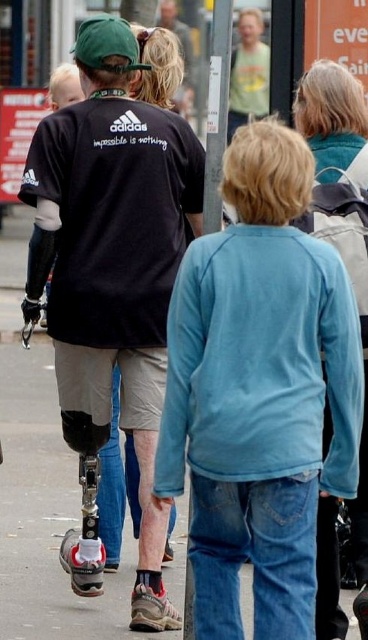
Looking at the scene, where is the matte blue sweatshirt at center in relation to the green cotton shirt at upper center?

The matte blue sweatshirt at center is to the left of the green cotton shirt at upper center.

You are a fashion designer observing the street scene. You need to determine which clothing item has a narrower width between the matte blue sweatshirt at center and the green cotton shirt at upper center. Which one is narrower?

The matte blue sweatshirt at center has a narrower width than the green cotton shirt at upper center.

You are a photographer trying to capture the scene. You notice two points in the image at coordinates point (190, 456) and point (150, 246). Which point would appear larger in your photo?

Point (190, 456) is closer to the camera than point (150, 246), so it would appear larger in the photo.